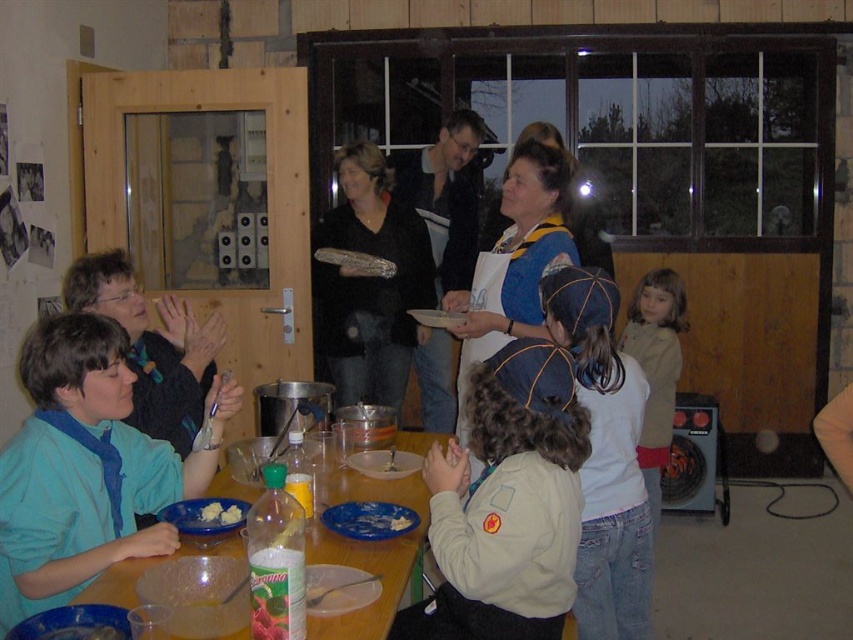
In the scene shown: You are a guest at the event and want to place a plate on the wooden table at center. However, there is a blue fabric apron at center in the way. Can you place the plate directly on the table without moving the apron?

The blue fabric apron at center is located above wooden table at center, so you cannot place the plate directly on the table without moving the apron.

You are a guest at this event and want to reach the white creamy food at center without disturbing anyone. Since the light brown hair at right is in your way, can you walk around it to get to the food?

The light brown hair at right is further to the viewer than the white creamy food at center, so you can walk around it to reach the food without obstruction.